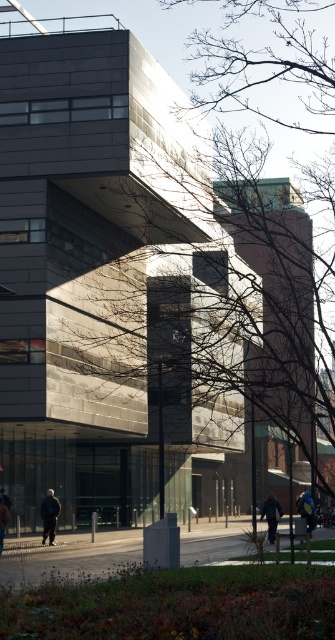
Measure the distance between point (261, 518) and camera.

Point (261, 518) is 232.33 feet away from camera.

Is dark blue jacket at lower center positioned before blue denim jacket at lower center?

Yes.

Is point (269, 506) positioned before point (311, 508)?

Yes.

The width and height of the screenshot is (335, 640). I want to click on dark blue jacket at lower center, so click(271, 515).

Can you confirm if dark blue jacket at lower left is thinner than blue denim jacket at lower center?

Indeed, dark blue jacket at lower left has a lesser width compared to blue denim jacket at lower center.

Based on the photo, can you confirm if dark blue jacket at lower left is positioned to the right of blue denim jacket at lower center?

In fact, dark blue jacket at lower left is to the left of blue denim jacket at lower center.

Is point (44, 515) less distant than point (300, 509)?

Yes.

This screenshot has width=335, height=640. Identify the location of dark blue jacket at lower left. (49, 515).

Does dark blue jacket at lower left have a greater width compared to dark gray jacket at lower left?

In fact, dark blue jacket at lower left might be narrower than dark gray jacket at lower left.

Between dark blue jacket at lower left and dark gray jacket at lower left, which one has more height?

With more height is dark gray jacket at lower left.

Identify the location of dark blue jacket at lower left. pos(49,515).